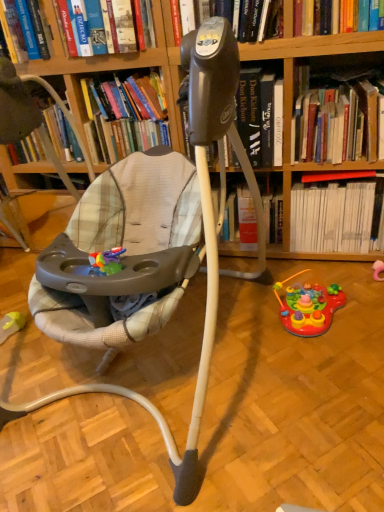
This screenshot has height=512, width=384. Find the location of `free space in front of rubberized plastic activity center at lower right, the 2th toy positioned from the right`. free space in front of rubberized plastic activity center at lower right, the 2th toy positioned from the right is located at coordinates (327, 369).